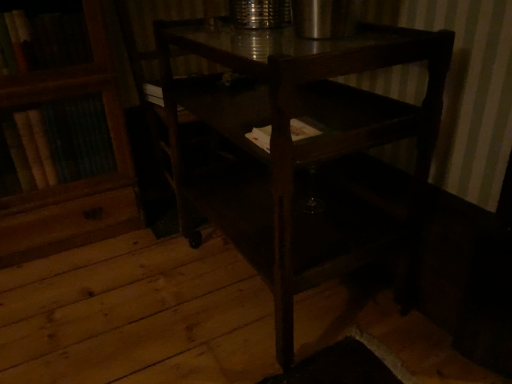
I want to click on white paper at center, so click(x=305, y=128).

Describe the element at coordinates (305, 128) in the screenshot. I see `white paper at center` at that location.

What is the approximate width of white paper at center?

4.57 inches.

You are a GUI agent. You are given a task and a screenshot of the screen. Output one action in this format:
    pyautogui.click(x=<x>, y=<y>)
    Task: Click on the dark wood table at center
    The width and height of the screenshot is (512, 384).
    Given the screenshot: What is the action you would take?
    pyautogui.click(x=302, y=149)

What do you see at coordinates (302, 149) in the screenshot?
I see `dark wood table at center` at bounding box center [302, 149].

The width and height of the screenshot is (512, 384). What are the coordinates of `white paper at center` in the screenshot? It's located at (305, 128).

In the scene shown: Can you confirm if dark wood table at center is positioned to the left of white paper at center?

No, dark wood table at center is not to the left of white paper at center.

Considering the positions of objects dark wood table at center and white paper at center in the image provided, who is behind, dark wood table at center or white paper at center?

white paper at center is behind.

Between point (192, 186) and point (314, 123), which one is positioned behind?

Point (192, 186)

From the image's perspective, which one is positioned lower, dark wood table at center or white paper at center?

dark wood table at center.

From a real-world perspective, is dark wood table at center over white paper at center?

No, from a real-world perspective, dark wood table at center is not over white paper at center

Which of these two, dark wood table at center or white paper at center, is thinner?

Thinner between the two is white paper at center.

Considering the relative sizes of dark wood table at center and white paper at center in the image provided, is dark wood table at center taller than white paper at center?

Correct, dark wood table at center is much taller as white paper at center.

Does dark wood table at center have a smaller size compared to white paper at center?

No, dark wood table at center is not smaller than white paper at center.

Looking at this image, is dark wood table at center inside the boundaries of white paper at center, or outside?

dark wood table at center is not enclosed by white paper at center.

Is dark wood table at center touching white paper at center?

dark wood table at center is not next to white paper at center, and they're not touching.

Could you tell me if dark wood table at center is turned towards white paper at center?

Yes, dark wood table at center is aimed at white paper at center.

Find the location of a particular element. table below the white paper at center (from the image's perspective) is located at coordinates (302, 149).

Can you confirm if white paper at center is positioned to the right of dark wood table at center?

Incorrect, white paper at center is not on the right side of dark wood table at center.

Which is behind, white paper at center or dark wood table at center?

white paper at center is further from the camera.

Does point (295, 135) appear closer or farther from the camera than point (417, 40)?

Point (295, 135).

Consider the image. From the image's perspective, who appears lower, white paper at center or dark wood table at center?

dark wood table at center.

Looking at this image, from a real-world perspective, who is located lower, white paper at center or dark wood table at center?

From a 3D spatial view, dark wood table at center is below.

In terms of width, does white paper at center look wider or thinner when compared to dark wood table at center?

Considering their sizes, white paper at center looks slimmer than dark wood table at center.

Which of these two, white paper at center or dark wood table at center, stands shorter?

Standing shorter between the two is white paper at center.

Does white paper at center have a smaller size compared to dark wood table at center?

Indeed, white paper at center has a smaller size compared to dark wood table at center.

Would you say white paper at center is outside dark wood table at center?

No, white paper at center is inside or overlapping with dark wood table at center.

Are white paper at center and dark wood table at center located far from each other?

Actually, white paper at center and dark wood table at center are a little close together.

Is dark wood table at center at the back of white paper at center?

Yes, white paper at center is facing away from dark wood table at center.

Looking at this image, can you tell me how much white paper at center and dark wood table at center differ in facing direction?

1.1 degrees.

Where is `book lying behind the dark wood table at center`? The image size is (512, 384). book lying behind the dark wood table at center is located at coordinates (305, 128).

The height and width of the screenshot is (384, 512). What are the coordinates of `book above the dark wood table at center (from a real-world perspective)` in the screenshot? It's located at (305, 128).

The height and width of the screenshot is (384, 512). In order to click on book above the dark wood table at center (from the image's perspective) in this screenshot , I will do `click(305, 128)`.